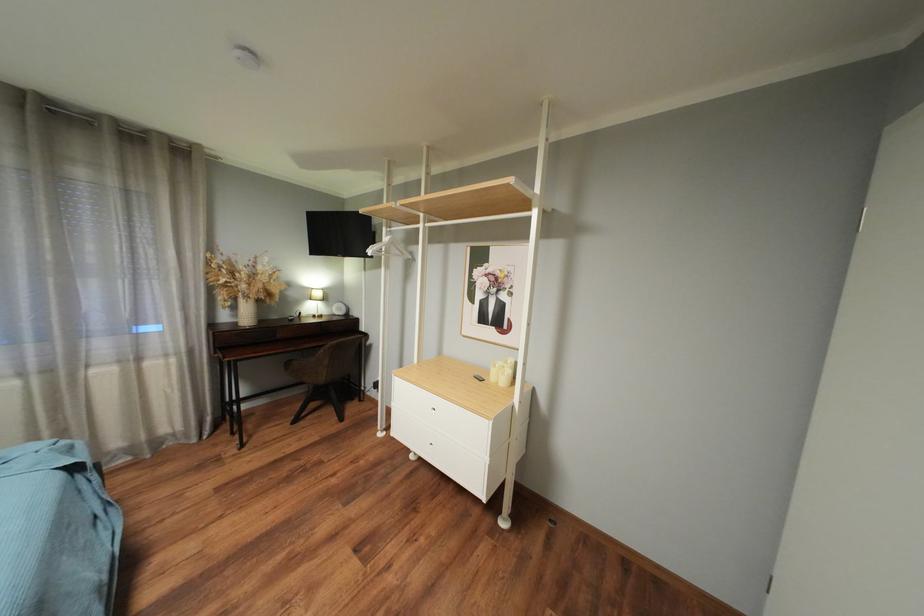
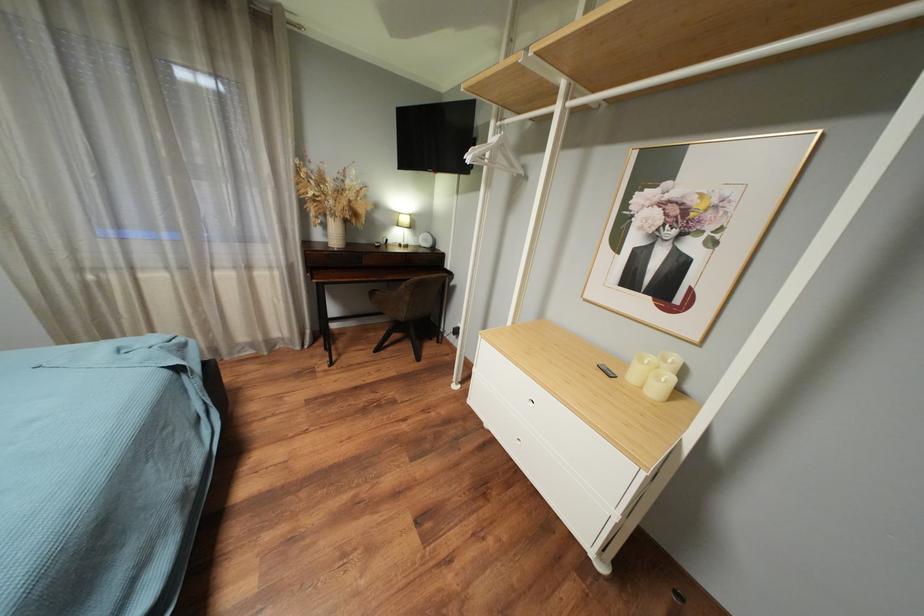
Which direction would the cameraman need to move to produce the second image?

The cameraman walked toward left, forward.